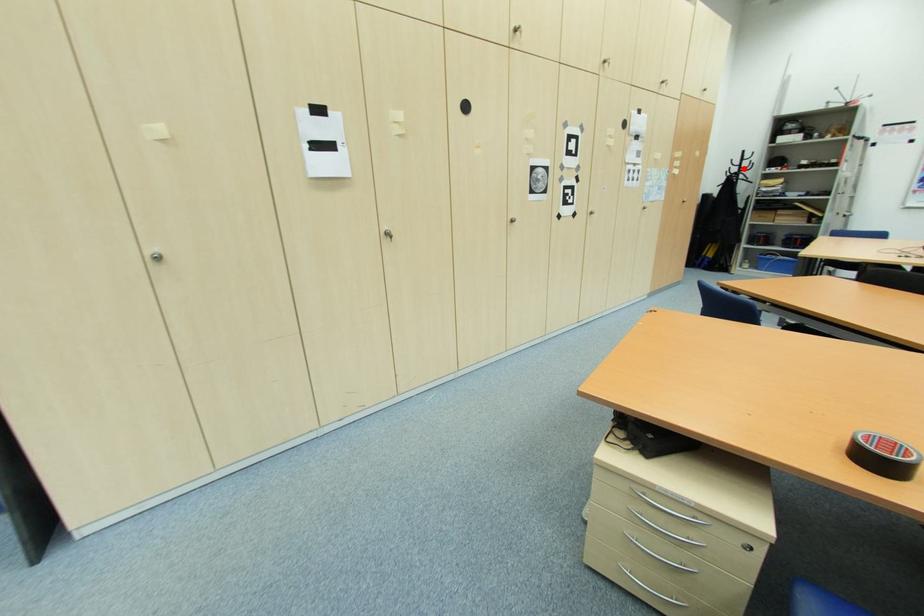
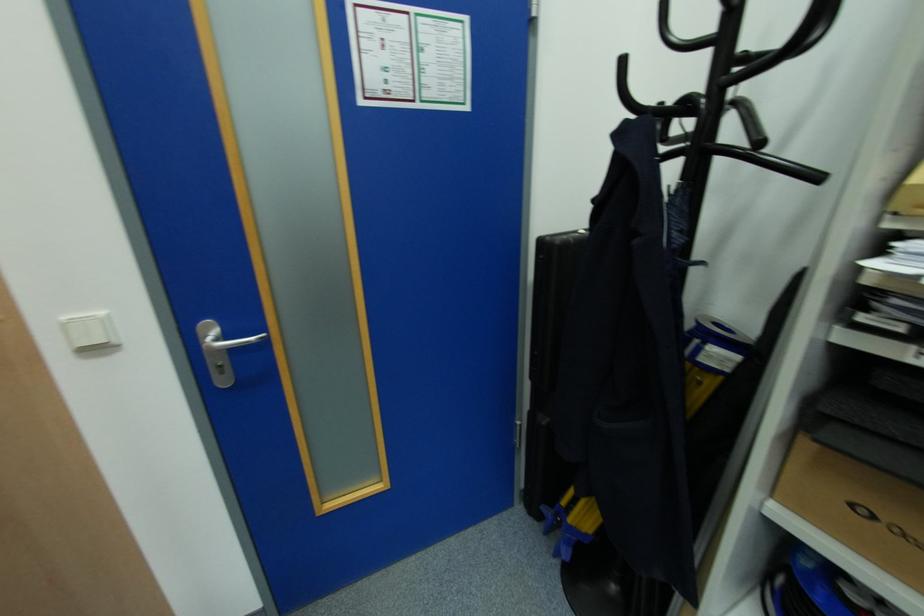
Locate, in the second image, the point that corresponds to the highlighted location in the first image.

(726, 61)